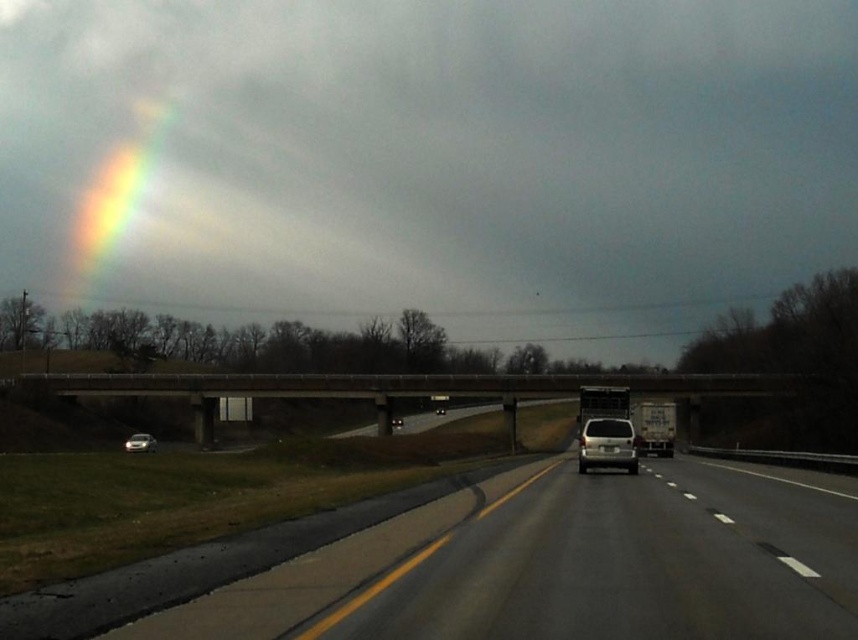
Question: Can you confirm if white matte suv at center is smaller than shiny silver car at lower left?

Choices:
 (A) yes
 (B) no

Answer: (A)

Question: In this image, where is white glossy car at center located relative to white matte suv at center?

Choices:
 (A) below
 (B) above

Answer: (B)

Question: Can you confirm if white glossy car at center is wider than shiny silver car at lower left?

Choices:
 (A) yes
 (B) no

Answer: (A)

Question: Among these objects, which one is farthest from the camera?

Choices:
 (A) white matte suv at center
 (B) matte white sedan at center
 (C) shiny silver car at lower left
 (D) white glossy car at center

Answer: (B)

Question: Which is nearer to the shiny silver car at lower left?

Choices:
 (A) matte white sedan at center
 (B) concrete bridge at center

Answer: (B)

Question: Which is nearer to the matte white sedan at center?

Choices:
 (A) shiny silver car at lower left
 (B) white matte suv at center
 (C) concrete bridge at center

Answer: (C)